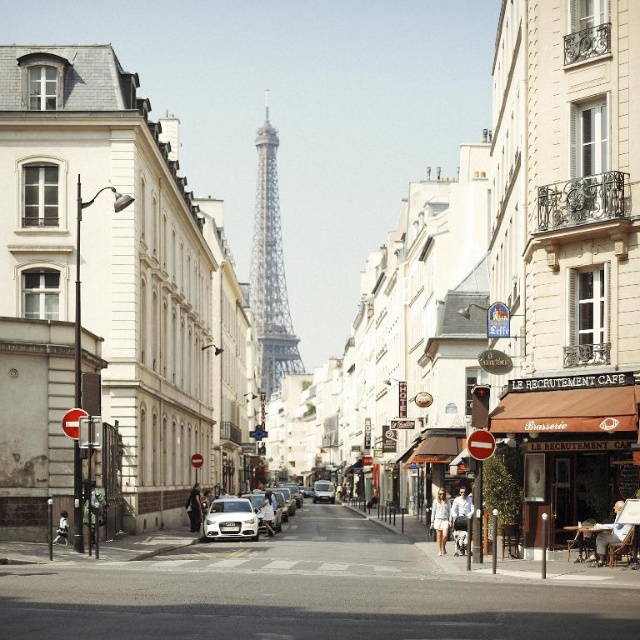
Which is more to the left, light blue denim jacket at center or dark blue fabric coat at center?

From the viewer's perspective, dark blue fabric coat at center appears more on the left side.

Is light blue denim jacket at center above dark blue fabric coat at center?

Yes, light blue denim jacket at center is above dark blue fabric coat at center.

Is point (445, 518) positioned in front of point (193, 525)?

Yes, point (445, 518) is closer to viewer.

I want to click on light blue denim jacket at center, so click(x=440, y=520).

Does satin silver car at center appear over light blue shirt at center?

No, satin silver car at center is not above light blue shirt at center.

Between satin silver car at center and light blue shirt at center, which one has less height?

With less height is light blue shirt at center.

Image resolution: width=640 pixels, height=640 pixels. What do you see at coordinates (230, 518) in the screenshot?
I see `satin silver car at center` at bounding box center [230, 518].

Locate an element on the screen. The width and height of the screenshot is (640, 640). satin silver car at center is located at coordinates (230, 518).

Who is positioned more to the right, dark blue fabric coat at center or white cotton shirt at center?

Positioned to the right is dark blue fabric coat at center.

Can you confirm if dark blue fabric coat at center is positioned below white cotton shirt at center?

Yes, dark blue fabric coat at center is below white cotton shirt at center.

Who is more forward, (x=193, y=492) or (x=67, y=529)?

Point (x=67, y=529) is in front.

Identify the location of dark blue fabric coat at center. (193, 508).